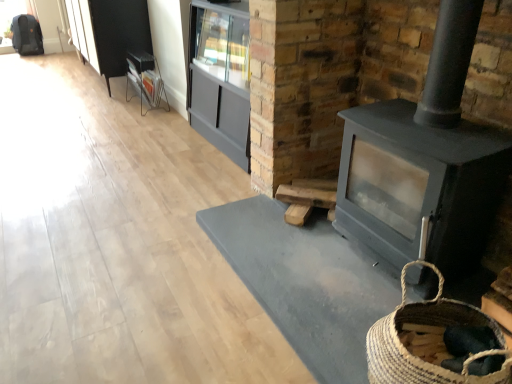
Find the location of a particular element. The height and width of the screenshot is (384, 512). free space to the left of matte gray wood burning stove at right is located at coordinates (294, 255).